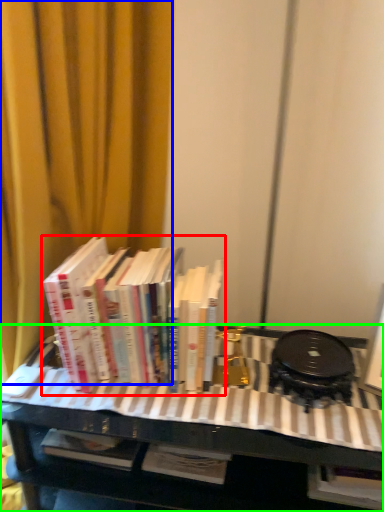
Question: Which object is positioned farthest from book (highlighted by a red box)? Select from curtain (highlighted by a blue box) and table (highlighted by a green box).

Choices:
 (A) curtain
 (B) table

Answer: (A)